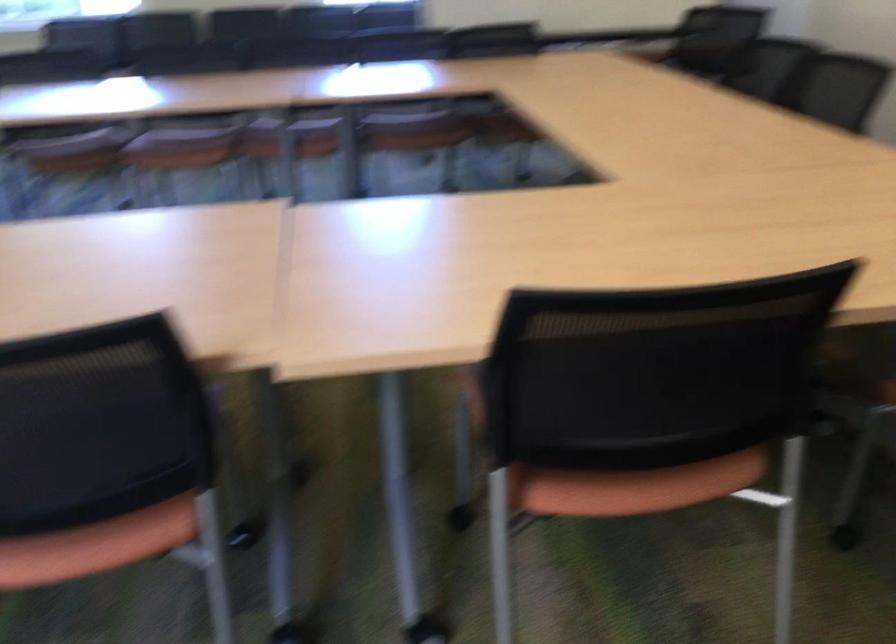
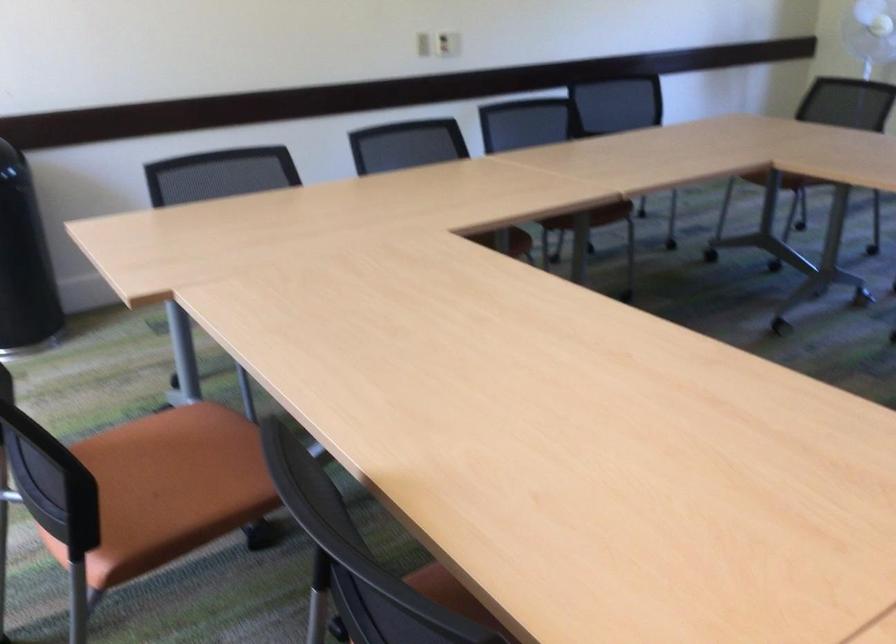
Question: The camera is either moving clockwise (left) or counter-clockwise (right) around the object. The first image is from the beginning of the video and the second image is from the end. Is the camera moving left or right when shooting the video?

Choices:
 (A) Left
 (B) Right

Answer: (B)